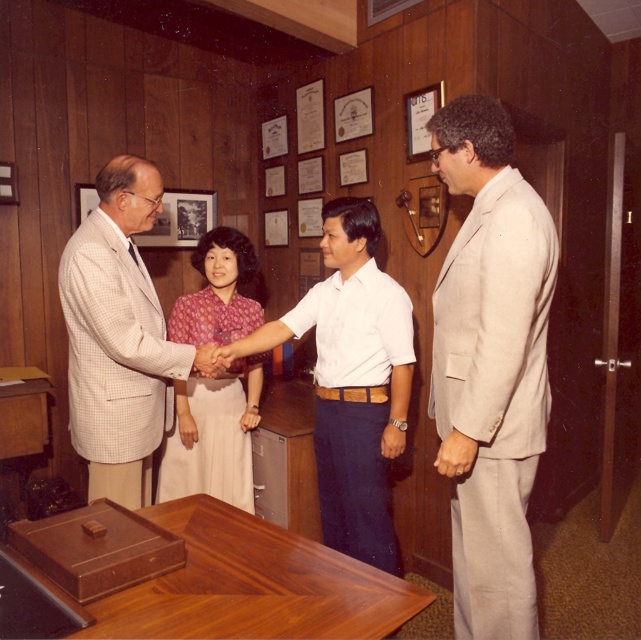
Does white cotton shirt at center lie behind matte skin hand at center?

Yes, it is behind matte skin hand at center.

Image resolution: width=641 pixels, height=640 pixels. I want to click on white cotton shirt at center, so click(x=353, y=380).

In the scene shown: Between beige suit at right and light beige checkered suit at left, which one has less height?

Standing shorter between the two is light beige checkered suit at left.

Is point (460, 608) behind point (119, 307)?

No.

Does point (467, 340) come closer to viewer compared to point (121, 451)?

Yes, point (467, 340) is in front of point (121, 451).

The width and height of the screenshot is (641, 640). Identify the location of beige suit at right. (490, 365).

From the picture: Can you confirm if matte pink blouse at center is positioned to the left of matte skin hand at center?

Yes, matte pink blouse at center is to the left of matte skin hand at center.

Which is below, matte pink blouse at center or matte skin hand at center?

Positioned lower is matte pink blouse at center.

Find the location of `matte pink blouse at center`. matte pink blouse at center is located at coordinates (212, 438).